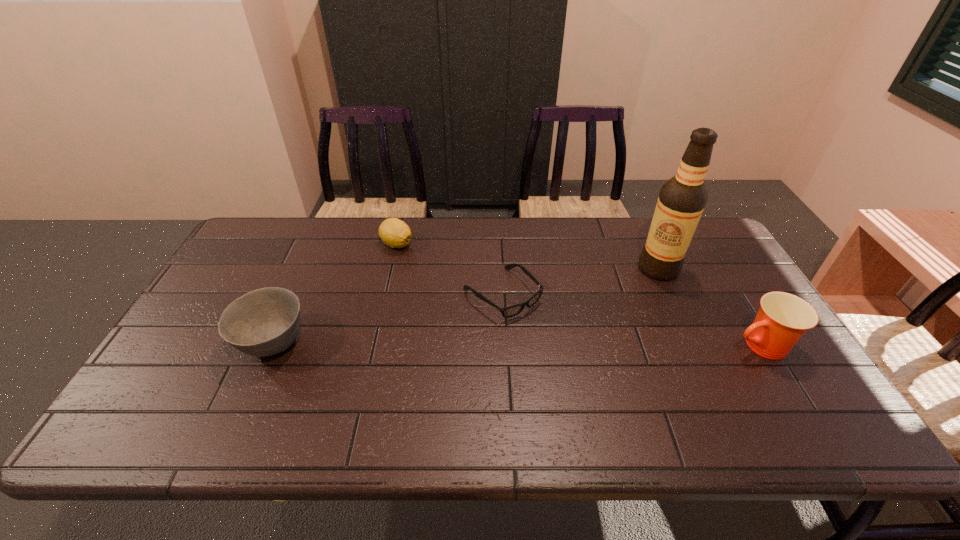
Where is `free region located at the stem end of the second shortest object`? The width and height of the screenshot is (960, 540). free region located at the stem end of the second shortest object is located at coordinates (443, 318).

Identify the location of alcohol positioned at the far edge. This screenshot has width=960, height=540. (682, 199).

Find the location of a particular element. lemon located in the far edge section of the desktop is located at coordinates (395, 233).

Where is `object that is at the near edge`? Image resolution: width=960 pixels, height=540 pixels. object that is at the near edge is located at coordinates (264, 322).

This screenshot has width=960, height=540. Identify the location of object that is at the left edge. (264, 322).

Find the location of `object present at the right edge`. object present at the right edge is located at coordinates (783, 318).

You are a GUI agent. You are given a task and a screenshot of the screen. Output one action in this format:
    pyautogui.click(x=<x>, y=<y>)
    Task: Click on the object at the near left corner
    
    Given the screenshot: What is the action you would take?
    pyautogui.click(x=264, y=322)

The width and height of the screenshot is (960, 540). In the image, there is a desktop. Find the location of `vacant space at the far edge`. vacant space at the far edge is located at coordinates (635, 216).

The width and height of the screenshot is (960, 540). I want to click on vacant space at the near edge of the desktop, so click(645, 400).

This screenshot has width=960, height=540. What are the coordinates of `blank space at the right edge of the desktop` in the screenshot? It's located at (732, 349).